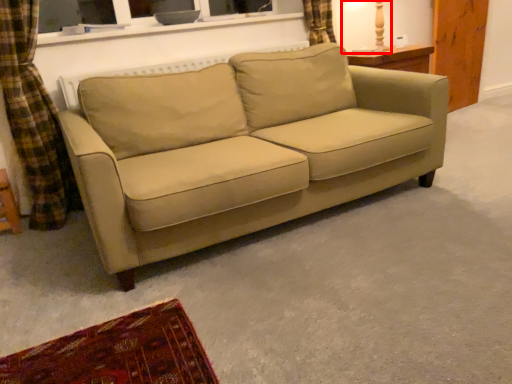
Question: From the image's perspective, where is table lamp (annotated by the red box) located relative to studio couch?

Choices:
 (A) above
 (B) below

Answer: (A)